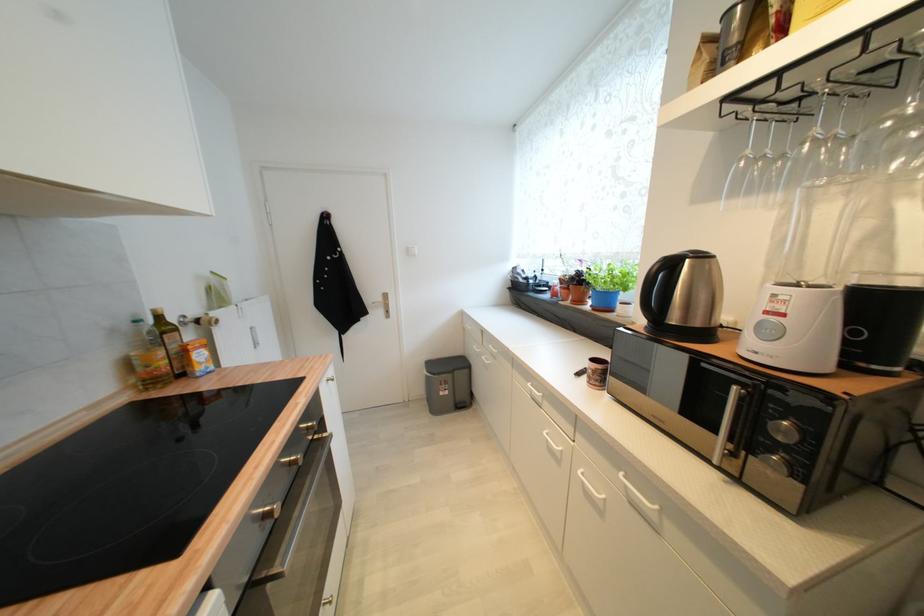
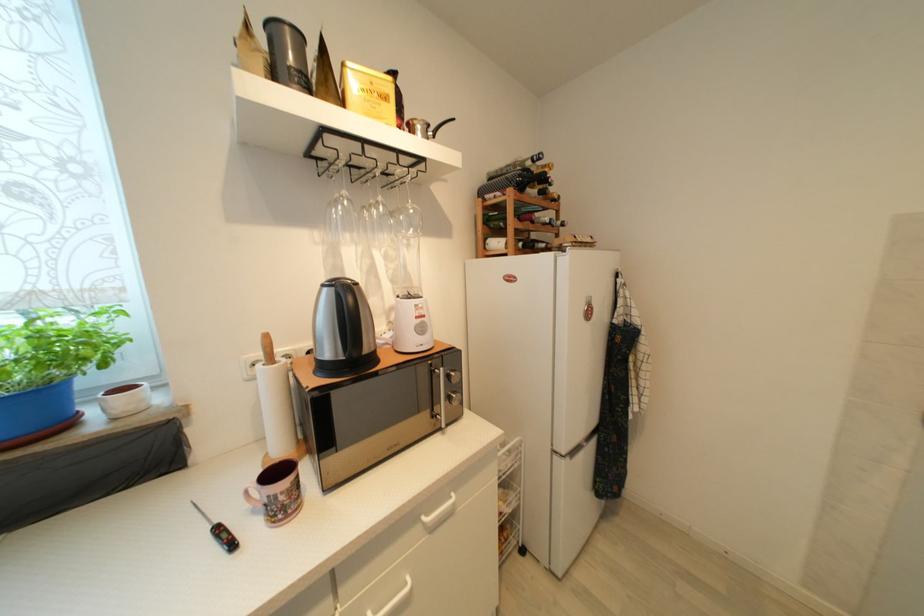
Locate, in the second image, the point that corresponds to (x=773, y=315) in the first image.

(421, 320)